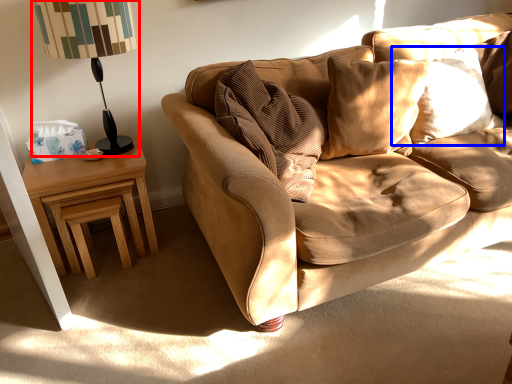
Question: Which object appears closest to the camera in this image, table lamp (highlighted by a red box) or pillow (highlighted by a blue box)?

Choices:
 (A) table lamp
 (B) pillow

Answer: (A)